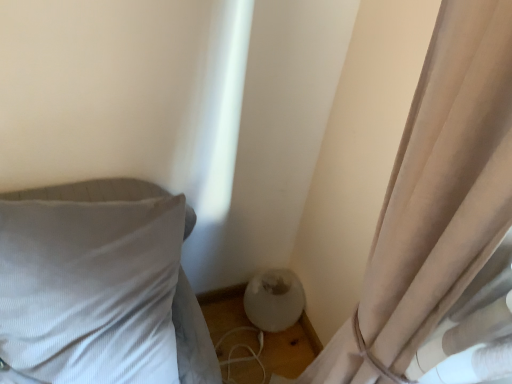
Image resolution: width=512 pixels, height=384 pixels. Describe the element at coordinates (90, 289) in the screenshot. I see `white textured pillow at left` at that location.

Find the location of a particular element. The height and width of the screenshot is (384, 512). white textured pillow at left is located at coordinates (90, 289).

Image resolution: width=512 pixels, height=384 pixels. Find the location of `white textured pillow at left`. white textured pillow at left is located at coordinates (90, 289).